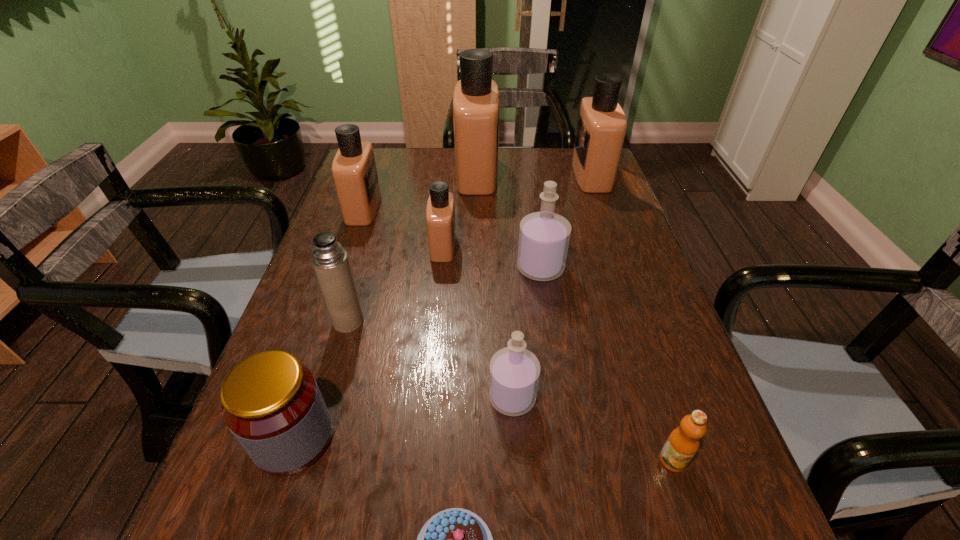
Identify the location of the biggest beige perfume. The height and width of the screenshot is (540, 960). (476, 97).

This screenshot has width=960, height=540. I want to click on the tallest perfume, so click(x=476, y=97).

Where is `the rightmost beige perfume`? The image size is (960, 540). the rightmost beige perfume is located at coordinates (601, 128).

Identify the location of the second biggest beige perfume. The width and height of the screenshot is (960, 540). (601, 128).

The height and width of the screenshot is (540, 960). Find the location of `the farther purple perfume`. the farther purple perfume is located at coordinates pos(544,236).

Identify the location of the second smallest beige perfume. The height and width of the screenshot is (540, 960). tap(354, 171).

At what (x,y) coordinates should I click in order to perform the action: click on the leftmost beige perfume. Please return your answer as a coordinate pair (x, y). This screenshot has width=960, height=540. Looking at the image, I should click on (354, 171).

Locate an element on the screen. Image resolution: width=960 pixels, height=540 pixels. the fifth nearest object is located at coordinates (330, 261).

At what (x,y) coordinates should I click in order to perform the action: click on the nearest beige perfume. Please return your answer as a coordinate pair (x, y). The width and height of the screenshot is (960, 540). Looking at the image, I should click on (440, 213).

The width and height of the screenshot is (960, 540). What are the coordinates of `the nearer purple perfume` in the screenshot? It's located at (514, 372).